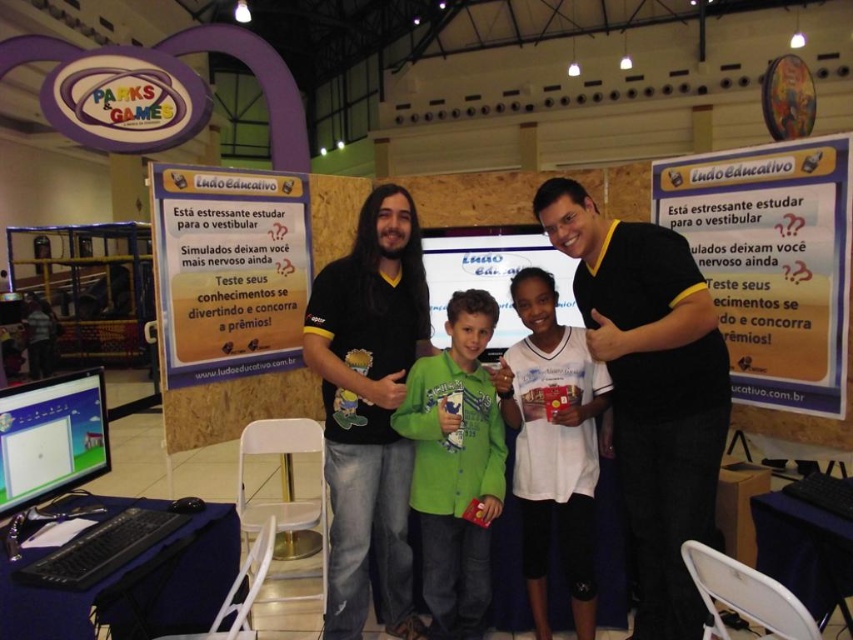
You are a photographer at the event and need to arrange the two people wearing the matte black shirt at center and the green matte shirt at center so that their shirts are visible in the photo. Which shirt should be positioned to the right to ensure both are clearly visible?

The matte black shirt at center should be positioned to the right of the green matte shirt at center to ensure both are clearly visible, as the matte black shirt at center is already to the right of the green matte shirt at center in the current arrangement.

What are the coordinates of the matte black shirt at center?

The matte black shirt at center is located at point (671,499).